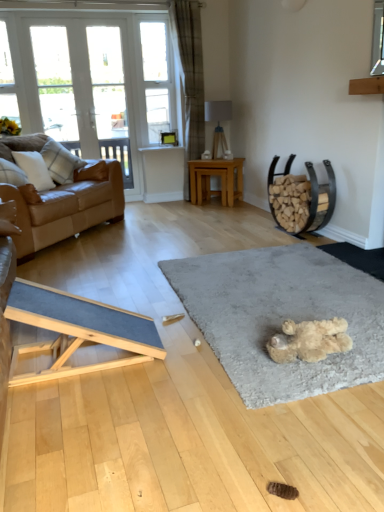
Locate an element on the screen. The height and width of the screenshot is (512, 384). free space in front of light brown wooden table at center, the 1th table viewed from the top is located at coordinates (217, 207).